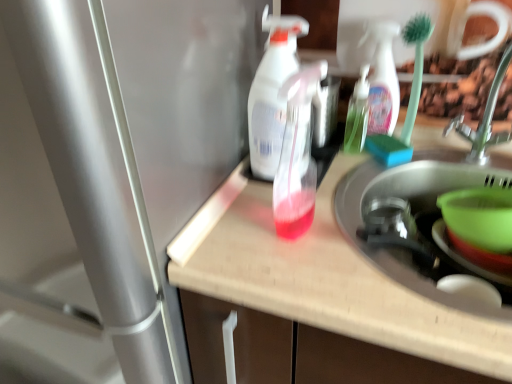
Locate an element on the screen. free space to the back side of translucent plastic spray bottle at center, marked as the 1th bottle in a front-to-back arrangement is located at coordinates (310, 183).